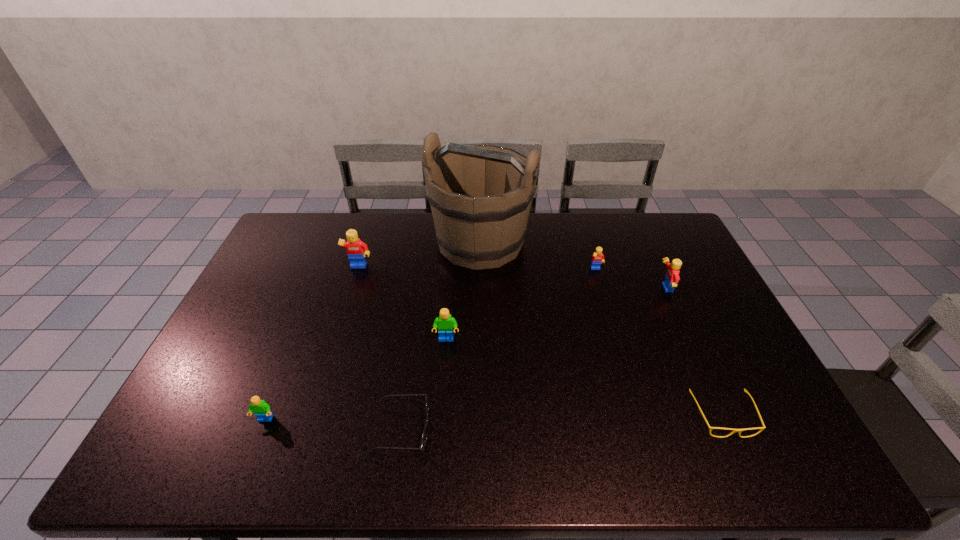
The image size is (960, 540). Identify the location of the tallest object. (480, 196).

At what (x,y) coordinates should I click in order to perform the action: click on the second object from left to right. Please return your answer as a coordinate pair (x, y). This screenshot has width=960, height=540. Looking at the image, I should click on (356, 249).

Where is `the leftmost yellow Lego`? This screenshot has height=540, width=960. the leftmost yellow Lego is located at coordinates (356, 249).

The image size is (960, 540). I want to click on the second smallest yellow Lego, so click(672, 277).

Image resolution: width=960 pixels, height=540 pixels. In order to click on the rightmost Lego in this screenshot , I will do `click(672, 277)`.

The image size is (960, 540). Identify the location of the bigger green Lego. (445, 323).

Image resolution: width=960 pixels, height=540 pixels. In order to click on the right green Lego in this screenshot , I will do `click(445, 323)`.

Where is `the fourth Lego from left to right`? the fourth Lego from left to right is located at coordinates (597, 258).

Image resolution: width=960 pixels, height=540 pixels. In order to click on the second yellow Lego from left to right in this screenshot , I will do `click(597, 258)`.

Where is `the smaller green Lego`? the smaller green Lego is located at coordinates (262, 410).